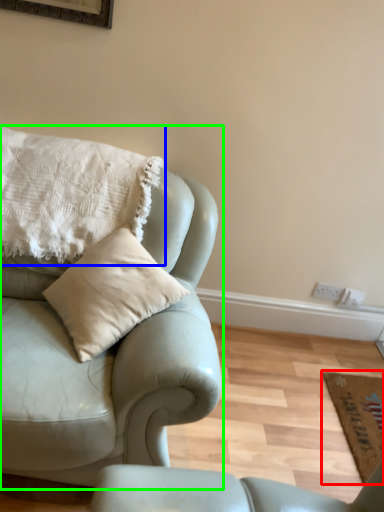
Question: Considering the real-world distances, which object is closest to mat (highlighted by a red box)? pillow (highlighted by a blue box) or studio couch (highlighted by a green box).

Choices:
 (A) pillow
 (B) studio couch

Answer: (B)